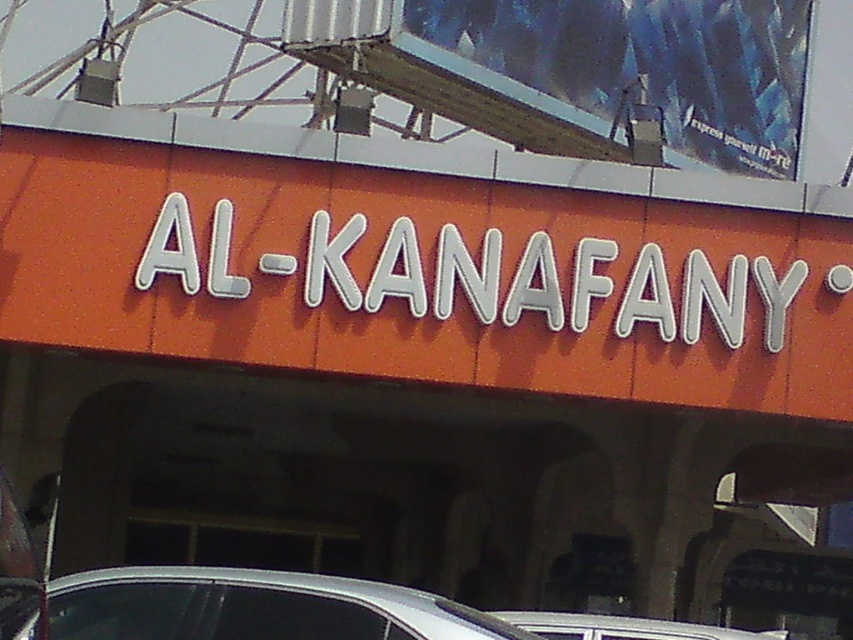
Looking at this image, you are a delivery driver who needs to park your silver metallic car at lower center near the orange matte sign at center. Can you park your car so that it doesn not block the sign?

The orange matte sign at center might be wider than silver metallic car at lower center, so there is a possibility that the car can be parked without blocking the sign if positioned correctly. However, since the exact width difference is uncertain, careful placement is recommended.

You are standing in front of the building and see two cars, the silver metallic car at lower center and the white plastic car at center. Which car is positioned to the right?

The white plastic car at center is positioned to the right of the silver metallic car at lower center.

You are standing in front of the building with the orange facade. You notice the metallic blue billboard at upper right. Can you determine its exact position relative to the building?

The metallic blue billboard at upper right is located at point (628, 74), which means it is positioned at the upper right corner of the building.